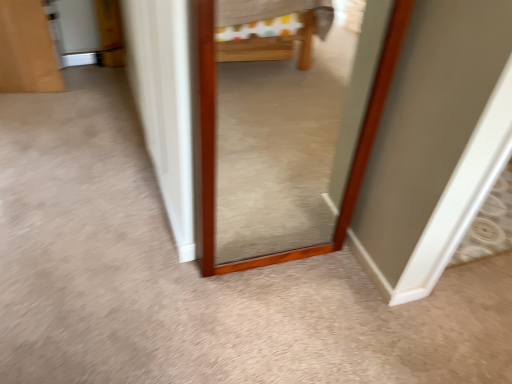
At what (x,y) coordinates should I click in order to perform the action: click on vacant region to the left of wooden frame mirror at center. Please return your answer as a coordinate pair (x, y). Looking at the image, I should click on (192, 265).